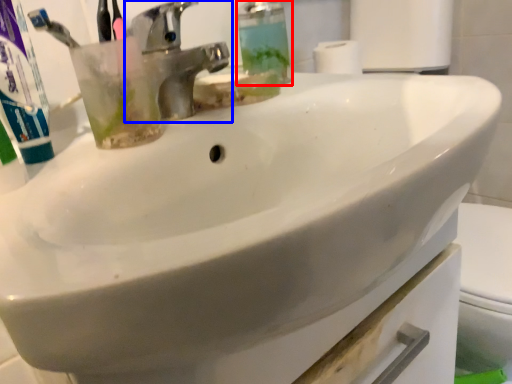
Question: Among these objects, which one is nearest to the camera, soap dispenser (highlighted by a red box) or tap (highlighted by a blue box)?

Choices:
 (A) soap dispenser
 (B) tap

Answer: (B)